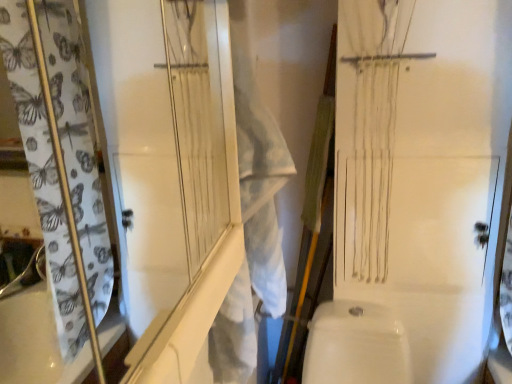
Question: Does white glossy toilet bowl at lower center have a larger size compared to white fabric laundry at center?

Choices:
 (A) no
 (B) yes

Answer: (B)

Question: Is white glossy toilet bowl at lower center oriented towards white fabric laundry at center?

Choices:
 (A) yes
 (B) no

Answer: (B)

Question: Is white glossy toilet bowl at lower center positioned before white fabric laundry at center?

Choices:
 (A) yes
 (B) no

Answer: (B)

Question: From the image's perspective, is white glossy toilet bowl at lower center located beneath white fabric laundry at center?

Choices:
 (A) no
 (B) yes

Answer: (B)

Question: Could white fabric laundry at center be considered to be inside white glossy toilet bowl at lower center?

Choices:
 (A) no
 (B) yes

Answer: (A)

Question: From a real-world perspective, is white glossy toilet bowl at lower center over white fabric laundry at center?

Choices:
 (A) no
 (B) yes

Answer: (A)

Question: Is white fabric laundry at center positioned far away from white glossy toilet bowl at lower center?

Choices:
 (A) no
 (B) yes

Answer: (A)

Question: Can you confirm if white fabric laundry at center is wider than white glossy toilet bowl at lower center?

Choices:
 (A) yes
 (B) no

Answer: (B)

Question: Can you confirm if white fabric laundry at center is thinner than white glossy toilet bowl at lower center?

Choices:
 (A) yes
 (B) no

Answer: (A)

Question: Is white fabric laundry at center taller than white glossy toilet bowl at lower center?

Choices:
 (A) no
 (B) yes

Answer: (B)

Question: Is white fabric laundry at center placed right next to white glossy toilet bowl at lower center?

Choices:
 (A) no
 (B) yes

Answer: (A)

Question: Is white fabric laundry at center oriented towards white glossy toilet bowl at lower center?

Choices:
 (A) no
 (B) yes

Answer: (A)

Question: Is white glossy toilet bowl at lower center turned away from white textured screen door at upper left?

Choices:
 (A) yes
 (B) no

Answer: (B)